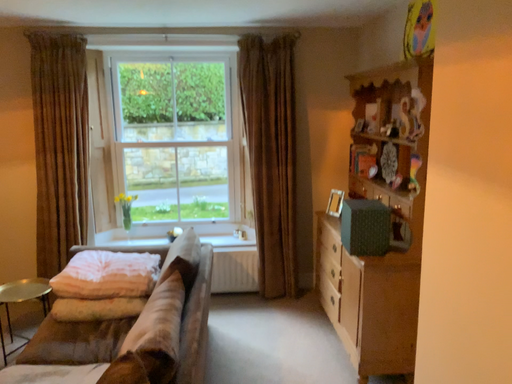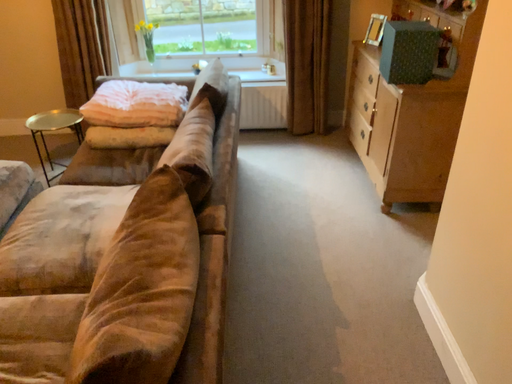
Question: Which way did the camera rotate in the video?

Choices:
 (A) rotated downward
 (B) rotated upward

Answer: (A)